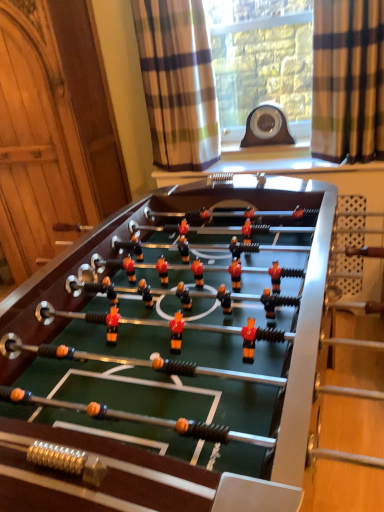
The width and height of the screenshot is (384, 512). Find the location of `free point below brown plaid curtain at upper right, which is the first curtain in right-to-left order (from a real-world perspective)`. free point below brown plaid curtain at upper right, which is the first curtain in right-to-left order (from a real-world perspective) is located at coordinates (347, 164).